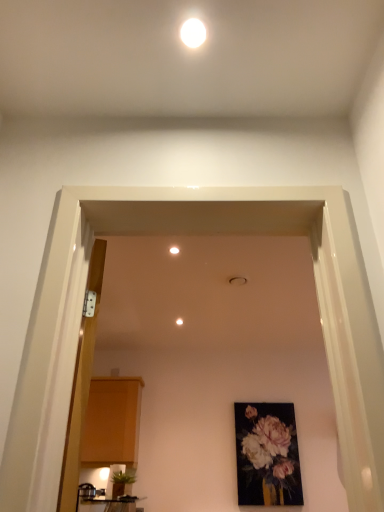
Question: From a real-world perspective, does matte black table at lower left sit lower than green leafy plant at lower left?

Choices:
 (A) yes
 (B) no

Answer: (A)

Question: Are matte black table at lower left and green leafy plant at lower left located far from each other?

Choices:
 (A) no
 (B) yes

Answer: (A)

Question: Is matte black table at lower left to the left of green leafy plant at lower left from the viewer's perspective?

Choices:
 (A) no
 (B) yes

Answer: (B)

Question: From a real-world perspective, is matte black table at lower left on top of green leafy plant at lower left?

Choices:
 (A) yes
 (B) no

Answer: (B)

Question: Does matte black table at lower left turn towards green leafy plant at lower left?

Choices:
 (A) no
 (B) yes

Answer: (A)

Question: Is matte floral painting at center situated inside white matte ceiling light at center, the first lighting positioned from the left, or outside?

Choices:
 (A) outside
 (B) inside

Answer: (A)

Question: Is matte floral painting at center wider or thinner than white matte ceiling light at center, marked as the 1th lighting in a bottom-to-top arrangement?

Choices:
 (A) thin
 (B) wide

Answer: (A)

Question: From the image's perspective, relative to white matte ceiling light at center, the 2th lighting positioned from the front, is matte floral painting at center above or below?

Choices:
 (A) above
 (B) below

Answer: (B)

Question: Based on their positions, is matte floral painting at center located to the left or right of white matte ceiling light at center, the first lighting positioned from the left?

Choices:
 (A) right
 (B) left

Answer: (A)

Question: Is wooden door at left to the left or to the right of white glossy light fixture at upper center, the 1th lighting viewed from the right, in the image?

Choices:
 (A) right
 (B) left

Answer: (B)

Question: Which is correct: wooden door at left is inside white glossy light fixture at upper center, which ranks as the second lighting in left-to-right order, or outside of it?

Choices:
 (A) inside
 (B) outside

Answer: (B)

Question: Is point (69, 500) closer or farther from the camera than point (192, 47)?

Choices:
 (A) farther
 (B) closer

Answer: (B)

Question: From the image's perspective, relative to white glossy light fixture at upper center, the second lighting from the back, is wooden door at left above or below?

Choices:
 (A) above
 (B) below

Answer: (B)

Question: In the image, is white matte ceiling light at center, which appears as the second lighting when viewed from the right, positioned in front of or behind matte black table at lower left?

Choices:
 (A) behind
 (B) front

Answer: (A)

Question: Considering the positions of white matte ceiling light at center, which appears as the second lighting when viewed from the right, and matte black table at lower left in the image, is white matte ceiling light at center, which appears as the second lighting when viewed from the right, taller or shorter than matte black table at lower left?

Choices:
 (A) tall
 (B) short

Answer: (B)